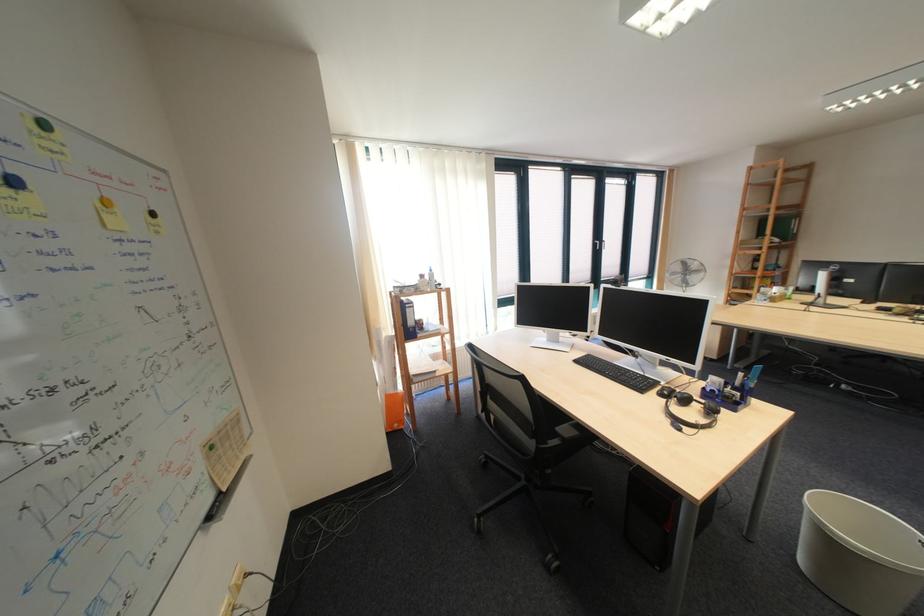
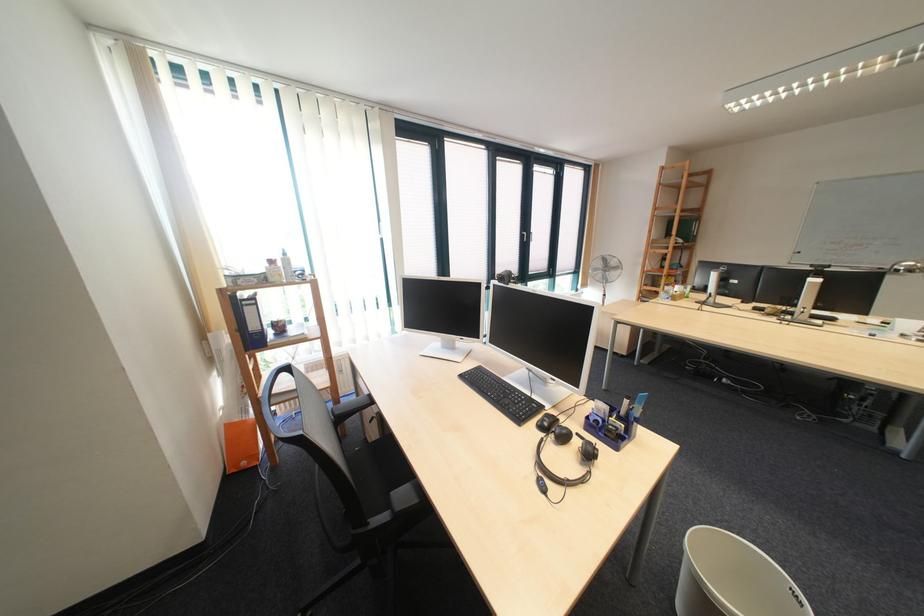
The point at (726, 392) is marked in the first image. Where is the corresponding point in the second image?

(611, 423)